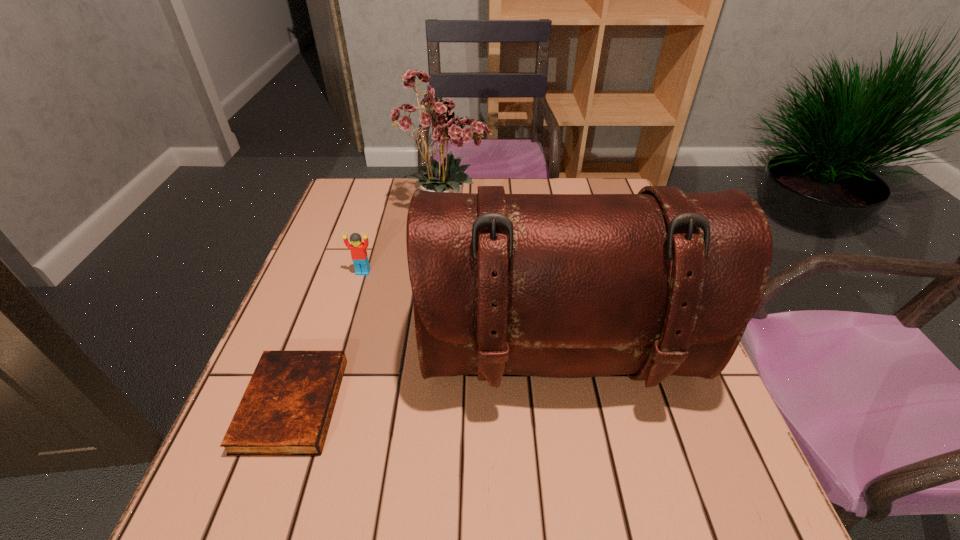
You are a GUI agent. You are given a task and a screenshot of the screen. Output one action in this format:
    pyautogui.click(x=<x>, y=<y>)
    Task: Click on the Lego located in the left edge section of the desktop
    The width and height of the screenshot is (960, 540).
    Given the screenshot: What is the action you would take?
    pyautogui.click(x=358, y=248)

The width and height of the screenshot is (960, 540). I want to click on Bible that is at the left edge, so click(x=286, y=409).

Identify the location of object that is at the right edge. This screenshot has width=960, height=540. (659, 283).

Image resolution: width=960 pixels, height=540 pixels. What are the coordinates of `free space at the far edge of the desktop` in the screenshot? It's located at (471, 192).

Image resolution: width=960 pixels, height=540 pixels. In the image, there is a desktop. In order to click on vacant space at the near edge in this screenshot , I will do `click(475, 511)`.

This screenshot has height=540, width=960. What are the coordinates of `vacant space at the left edge of the desktop` in the screenshot? It's located at (320, 242).

This screenshot has width=960, height=540. In the image, there is a desktop. Identify the location of free space at the right edge. (678, 433).

You are a GUI agent. You are given a task and a screenshot of the screen. Output one action in this format:
    pyautogui.click(x=<x>, y=<y>)
    Task: Click on the vacant space at the far left corner of the desktop
    The image size is (960, 540).
    Given the screenshot: What is the action you would take?
    pyautogui.click(x=364, y=212)

What are the coordinates of `vacant region between the flower arrangement and the shortest object` in the screenshot? It's located at (370, 308).

Locate an element on the screen. The image size is (960, 540). free space between the second farthest object and the flower arrangement is located at coordinates (405, 242).